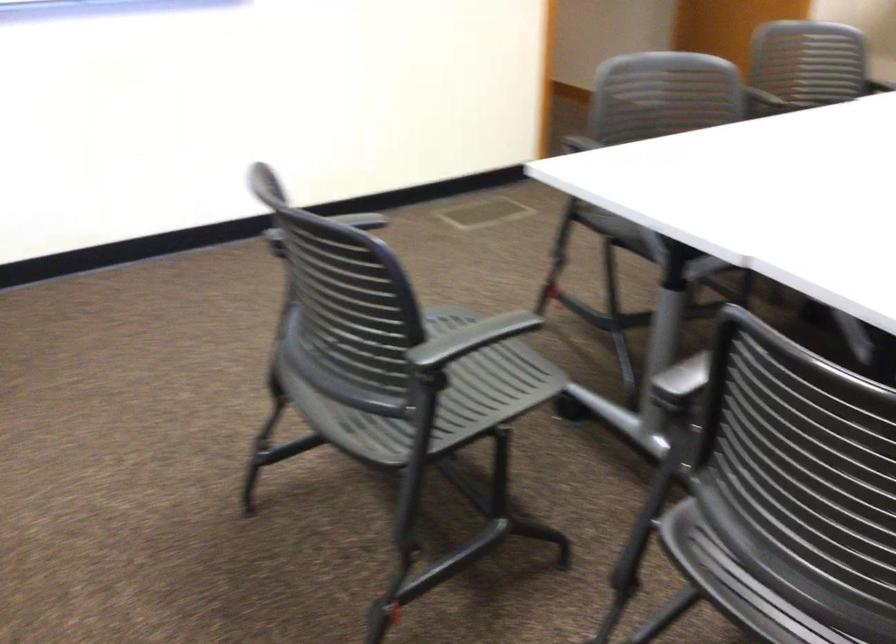
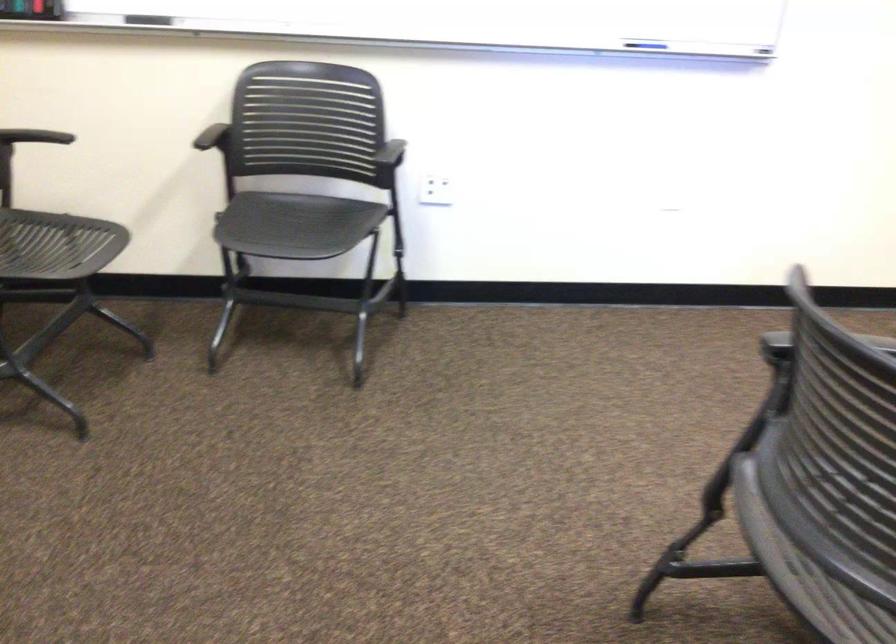
Question: The images are taken continuously from a first-person perspective. In which direction is your viewpoint rotating?

Choices:
 (A) Left
 (B) Right
 (C) Up
 (D) Down

Answer: (A)